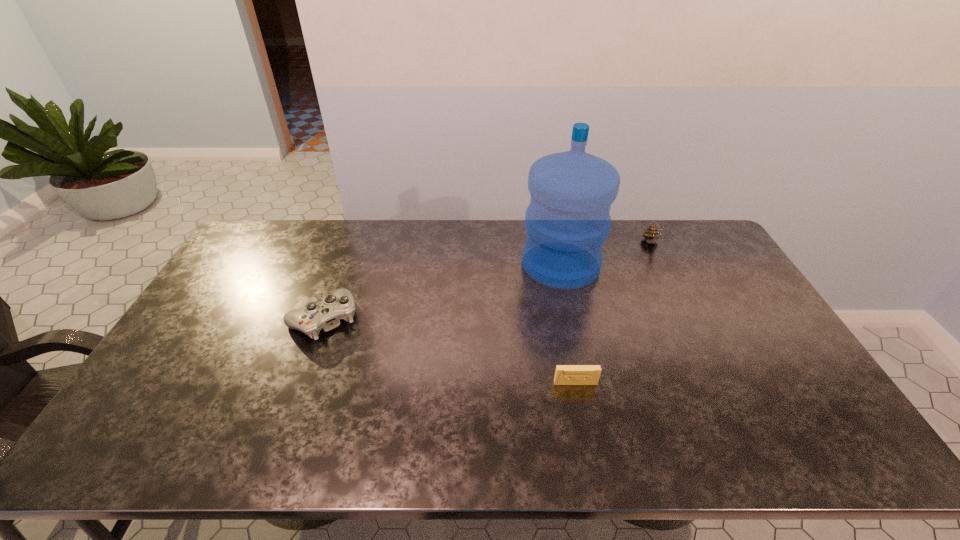
Find the location of a particular element. water jug is located at coordinates (567, 221).

Locate an element on the screen. snail is located at coordinates (652, 235).

The width and height of the screenshot is (960, 540). I want to click on the rightmost object, so click(652, 235).

Where is `control`? control is located at coordinates (326, 315).

This screenshot has width=960, height=540. Find the location of `the second shortest object`. the second shortest object is located at coordinates (326, 315).

Locate an element on the screen. the nearest object is located at coordinates (565, 374).

Find the location of a particular element. videotape is located at coordinates tap(565, 374).

Where is `vacant space situated on the right of the tallest object`? Image resolution: width=960 pixels, height=540 pixels. vacant space situated on the right of the tallest object is located at coordinates [705, 264].

The height and width of the screenshot is (540, 960). I want to click on vacant space located 0.130m on the face of the snail, so click(668, 277).

Image resolution: width=960 pixels, height=540 pixels. Identify the location of vacant region located on the left of the second shortest object. (194, 319).